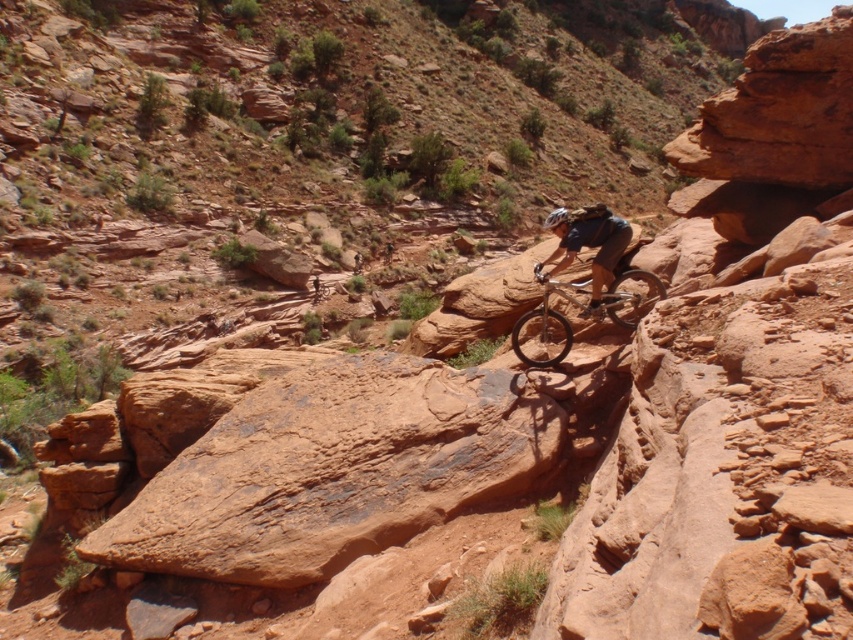
Can you confirm if silver metallic mountain bike at center is positioned above shiny black helmet at center?

Incorrect, silver metallic mountain bike at center is not positioned above shiny black helmet at center.

Between silver metallic mountain bike at center and shiny black helmet at center, which one has more height?

shiny black helmet at center

Where is `silver metallic mountain bike at center`? silver metallic mountain bike at center is located at coordinates (547, 321).